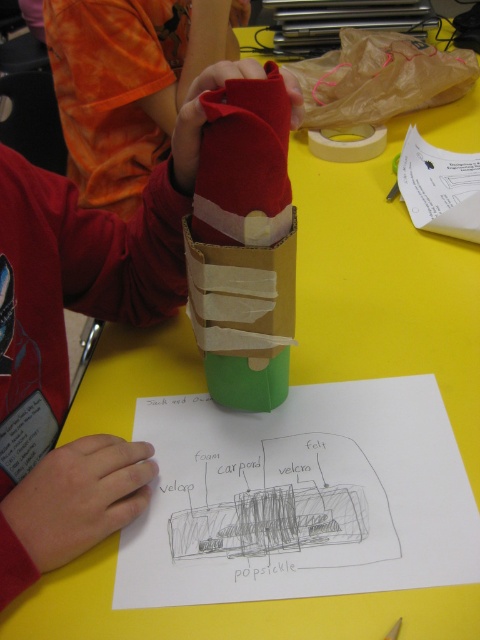
Looking at this image, you are a teacher observing the classroom activity. You notice the brown paper bag at upper center and the white paper at upper right on the table. Which object is taller?

The brown paper bag at upper center is much taller than the white paper at upper right.